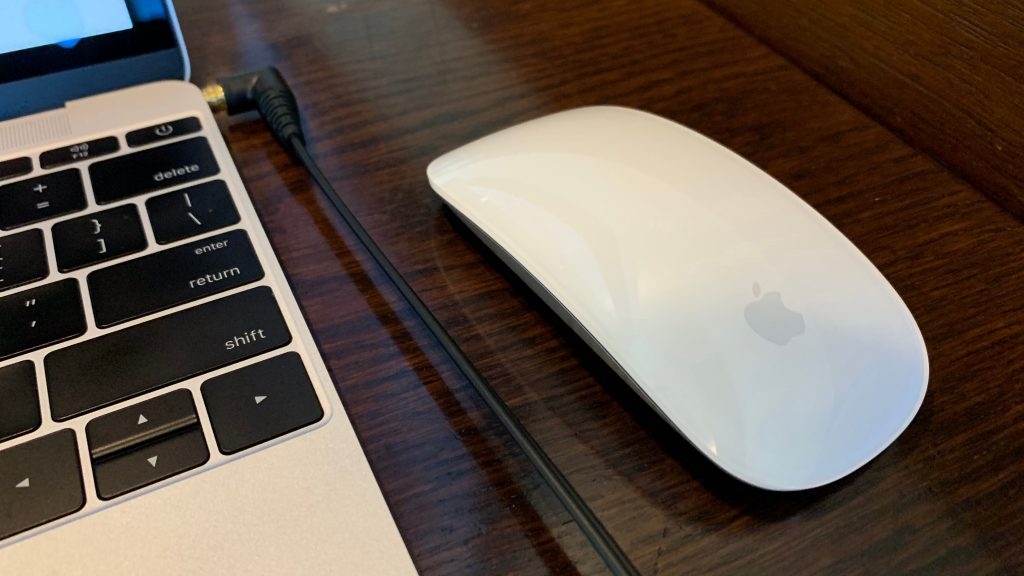
The height and width of the screenshot is (576, 1024). In order to click on mouse in this screenshot , I will do `click(687, 276)`.